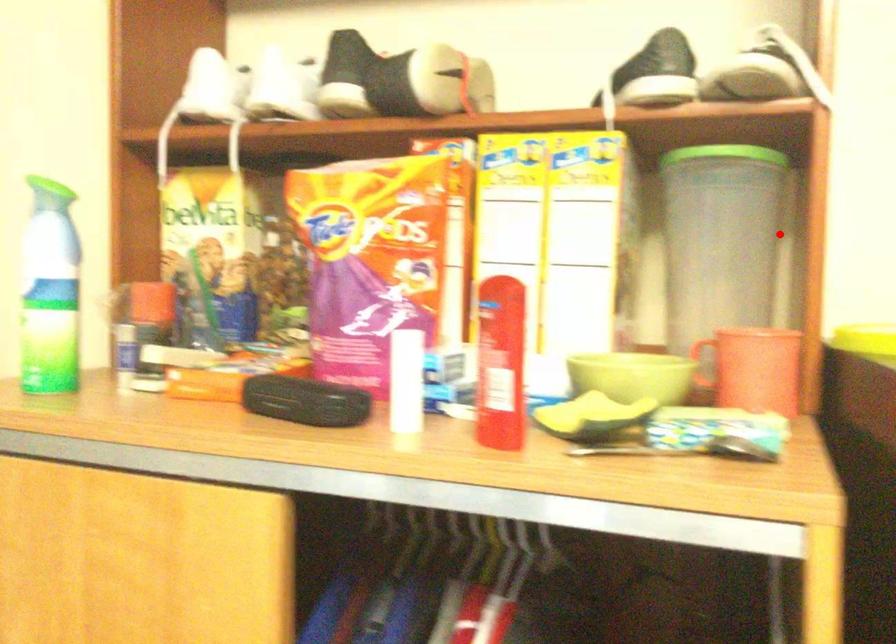
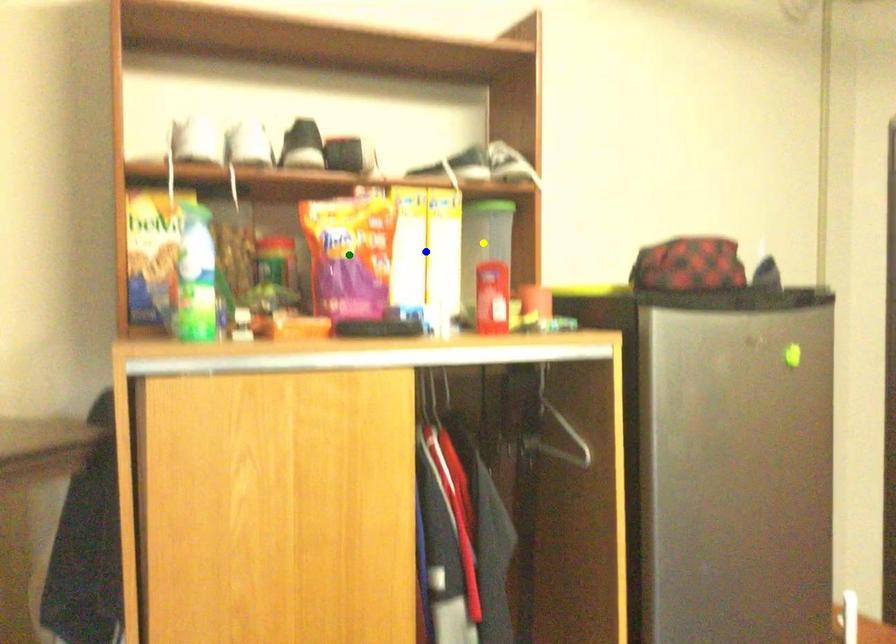
Question: I am providing you with two images of the same scene from different viewpoints. A red point is marked on the first image. You are given multiple points on the second image. Which mark in image 2 goes with the point in image 1?

Choices:
 (A) blue point
 (B) green point
 (C) yellow point

Answer: (C)